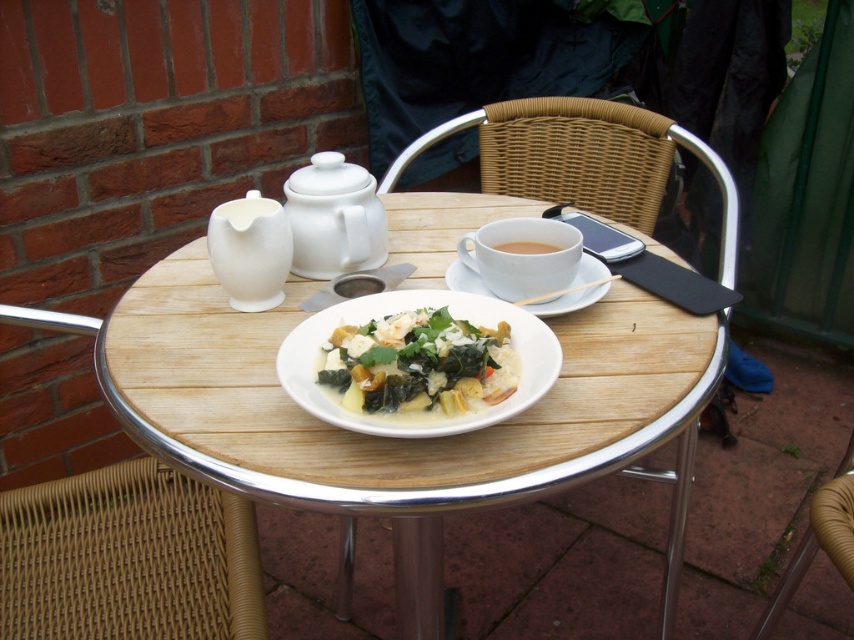
Is creamy white sauce at center below white ceramic saucer at center?

Correct, creamy white sauce at center is located below white ceramic saucer at center.

Describe the element at coordinates (419, 364) in the screenshot. I see `creamy white sauce at center` at that location.

Locate an element on the screen. The image size is (854, 640). creamy white sauce at center is located at coordinates (419, 364).

Which is above, woven wicker chair at lower left or white matte cup at center?

white matte cup at center

Is woven wicker chair at lower left positioned before white matte cup at center?

Yes.

Is point (15, 612) closer to viewer compared to point (499, 227)?

That is True.

The height and width of the screenshot is (640, 854). In order to click on woven wicker chair at lower left in this screenshot , I will do `click(127, 557)`.

Is white ceramic teapot at upper center smaller than white glossy teapot at upper left?

Incorrect, white ceramic teapot at upper center is not smaller in size than white glossy teapot at upper left.

Who is more forward, (348, 182) or (258, 196)?

Point (258, 196) is in front.

Where is `white ceramic teapot at upper center`? white ceramic teapot at upper center is located at coordinates (334, 218).